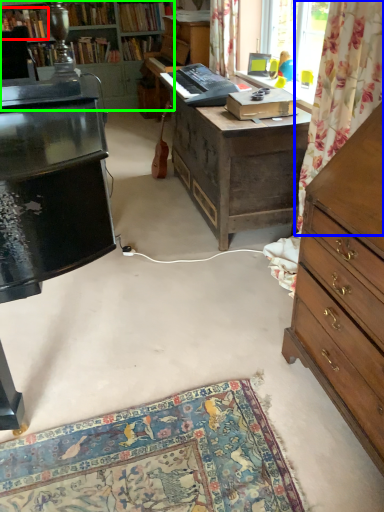
Question: Which is nearer to the book (highlighted by a red box)? tapestry (highlighted by a blue box) or cabinetry (highlighted by a green box).

Choices:
 (A) tapestry
 (B) cabinetry

Answer: (B)